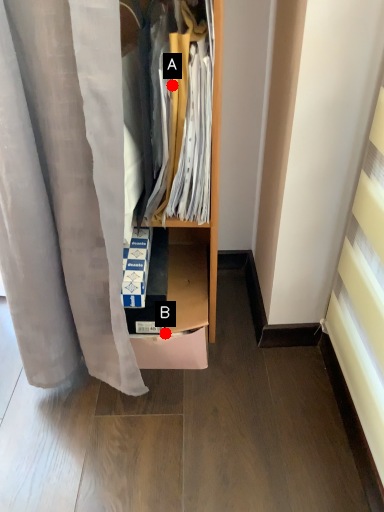
Question: Two points are circled on the image, labeled by A and B beside each circle. Which point appears farthest from the camera in this image?

Choices:
 (A) A is further
 (B) B is further

Answer: (B)